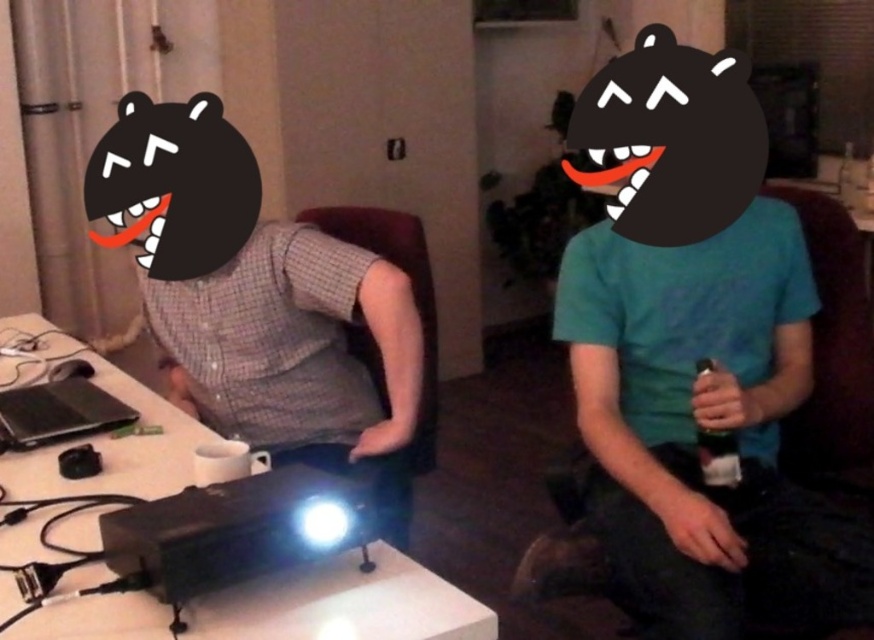
Looking at this image, you are a delivery person who needs to place a 1 meter long package between the white glossy projector at center and the black plastic bottle at right. Can you fit it there?

The distance between the white glossy projector at center and the black plastic bottle at right is 85.44 centimeters, which is shorter than the 1 meter package. Therefore, the package cannot be placed between them.

Consider the image. You are a photographer trying to capture a candid shot of the two people in the scene. Since you want to focus on the gray checkered shirt at center and the black plastic bottle at right, where should you position your camera relative to the subjects to ensure both are in frame?

Position the camera to the left of the gray checkered shirt at center so that the black plastic bottle at right is visible to the right of the shirt, as the gray checkered shirt at center is to the left of the black plastic bottle at right.